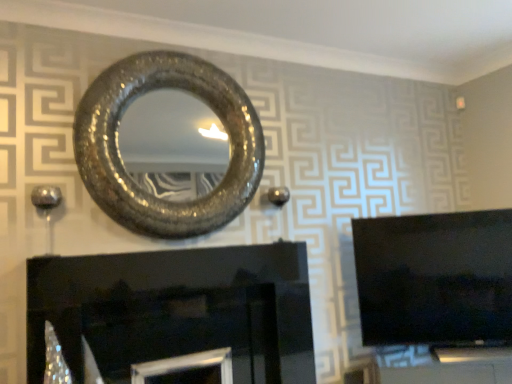
In order to face shiny metallic mirror at upper center, should I rotate leftwards or rightwards?

Turn left by 10.076 degrees to look at shiny metallic mirror at upper center.

Identify the location of black glossy fireplace at lower center. (176, 310).

Locate an element on the screen. black glossy tv at right is located at coordinates (434, 277).

Is point (128, 382) closer to camera compared to point (255, 152)?

Yes.

Can you tell me how much black glossy fireplace at lower center and shiny metallic mirror at upper center differ in facing direction?

The facing directions of black glossy fireplace at lower center and shiny metallic mirror at upper center are 0.132 degrees apart.

Which object is positioned more to the left, black glossy fireplace at lower center or shiny metallic mirror at upper center?

shiny metallic mirror at upper center is more to the left.

Which point is more forward, (x=82, y=376) or (x=355, y=229)?

The point (x=82, y=376) is more forward.

Are black glossy fireplace at lower center and black glossy tv at right located far from each other?

black glossy fireplace at lower center is actually quite close to black glossy tv at right.

Is black glossy tv at right completely or partially inside black glossy fireplace at lower center?

No, black glossy tv at right is not inside black glossy fireplace at lower center.

Is black glossy fireplace at lower center wider than black glossy tv at right?

Yes, black glossy fireplace at lower center is wider than black glossy tv at right.

Is shiny metallic mirror at upper center in contact with black glossy fireplace at lower center?

shiny metallic mirror at upper center and black glossy fireplace at lower center are not in contact.

Which of these two, shiny metallic mirror at upper center or black glossy fireplace at lower center, stands taller?

Standing taller between the two is shiny metallic mirror at upper center.

From the image's perspective, which one is positioned higher, shiny metallic mirror at upper center or black glossy fireplace at lower center?

shiny metallic mirror at upper center.

From a real-world perspective, is shiny metallic mirror at upper center under black glossy fireplace at lower center?

No.

In the scene shown: Would you consider black glossy tv at right to be distant from shiny metallic mirror at upper center?

Indeed, black glossy tv at right is not near shiny metallic mirror at upper center.

Looking at this image, can you confirm if black glossy tv at right is taller than shiny metallic mirror at upper center?

No, black glossy tv at right is not taller than shiny metallic mirror at upper center.

Could you tell me if black glossy tv at right is turned towards shiny metallic mirror at upper center?

No, black glossy tv at right is not oriented towards shiny metallic mirror at upper center.

Is black glossy tv at right not inside shiny metallic mirror at upper center?

Indeed, black glossy tv at right is completely outside shiny metallic mirror at upper center.

Does point (134, 223) come in front of point (503, 258)?

Yes, it is in front of point (503, 258).

Looking at their sizes, would you say shiny metallic mirror at upper center is wider or thinner than black glossy tv at right?

shiny metallic mirror at upper center is thinner than black glossy tv at right.

From the image's perspective, which one is positioned higher, shiny metallic mirror at upper center or black glossy tv at right?

shiny metallic mirror at upper center is shown above in the image.

What are the coordinates of `television lying behind the black glossy fireplace at lower center` in the screenshot? It's located at (434, 277).

Who is taller, black glossy tv at right or black glossy fireplace at lower center?

With more height is black glossy tv at right.

Is black glossy fireplace at lower center located within black glossy tv at right?

Actually, black glossy fireplace at lower center is outside black glossy tv at right.

From a real-world perspective, who is located lower, black glossy tv at right or black glossy fireplace at lower center?

black glossy fireplace at lower center is physically lower.

Locate an element on the screen. oval behind the black glossy fireplace at lower center is located at coordinates (122, 160).

Where is `fireplace in front of the black glossy tv at right`? The width and height of the screenshot is (512, 384). fireplace in front of the black glossy tv at right is located at coordinates (176, 310).

When comparing their distances from shiny metallic mirror at upper center, does black glossy tv at right or black glossy fireplace at lower center seem closer?

Based on the image, black glossy fireplace at lower center appears to be nearer to shiny metallic mirror at upper center.

Considering their positions, is black glossy tv at right positioned further to black glossy fireplace at lower center than shiny metallic mirror at upper center?

black glossy tv at right is further to black glossy fireplace at lower center.

From the image, which object appears to be nearer to shiny metallic mirror at upper center, black glossy fireplace at lower center or black glossy tv at right?

black glossy fireplace at lower center is closer to shiny metallic mirror at upper center.

Which object lies nearer to the anchor point black glossy tv at right, shiny metallic mirror at upper center or black glossy fireplace at lower center?

Among the two, black glossy fireplace at lower center is located nearer to black glossy tv at right.

Looking at the image, which one is located further to black glossy tv at right, black glossy fireplace at lower center or shiny metallic mirror at upper center?

shiny metallic mirror at upper center is further to black glossy tv at right.

Considering their positions, is shiny metallic mirror at upper center positioned further to black glossy fireplace at lower center than black glossy tv at right?

black glossy tv at right.

The width and height of the screenshot is (512, 384). In order to click on fireplace located between shiny metallic mirror at upper center and black glossy tv at right in the left-right direction in this screenshot , I will do `click(176, 310)`.